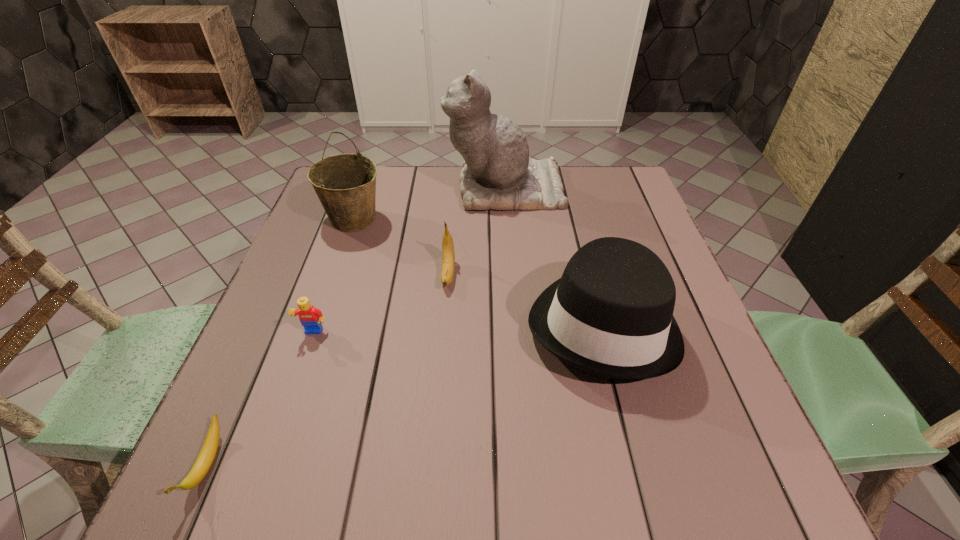
Where is `cat`? cat is located at coordinates (497, 173).

Where is `the fifth shortest object`? the fifth shortest object is located at coordinates (345, 184).

The image size is (960, 540). Identify the location of fedora. (610, 314).

This screenshot has width=960, height=540. I want to click on the fourth tallest object, so click(448, 255).

This screenshot has width=960, height=540. I want to click on the taller banana, so click(448, 255).

The image size is (960, 540). Find the location of `the fifth tallest object`. the fifth tallest object is located at coordinates (310, 317).

Identify the location of the left banana. This screenshot has width=960, height=540. (207, 454).

You are a GUI agent. You are given a task and a screenshot of the screen. Output one action in this format:
    pyautogui.click(x=<x>, y=<y>)
    Task: Click on the nearer banana
    The width and height of the screenshot is (960, 540).
    Given the screenshot: What is the action you would take?
    pyautogui.click(x=207, y=454)

Locate an element on the screen. Image resolution: width=960 pixels, height=540 pixels. vacant space located 0.080m on the front-facing side of the tallest object is located at coordinates (419, 188).

Where is `vacant space located 0.110m on the front-facing side of the tallest object`? vacant space located 0.110m on the front-facing side of the tallest object is located at coordinates (408, 188).